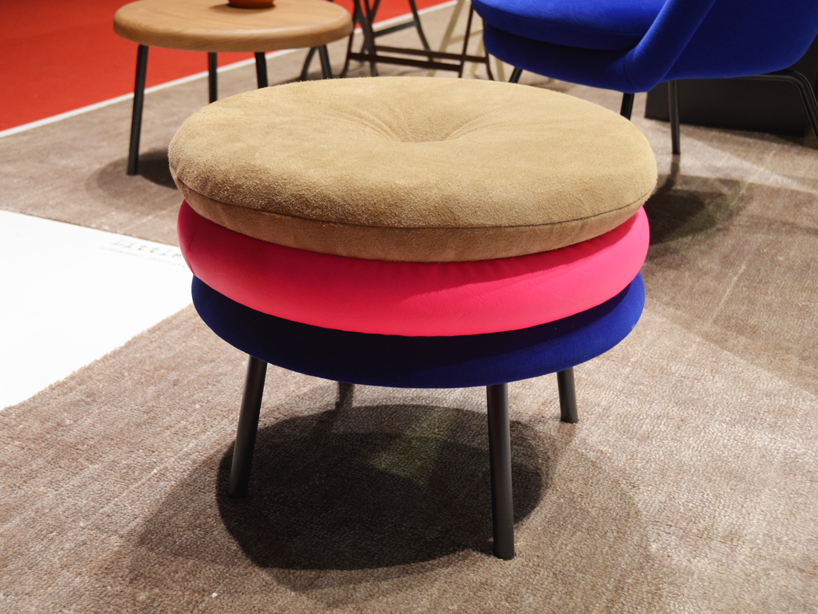
Where is `stool leg`? stool leg is located at coordinates (249, 410).